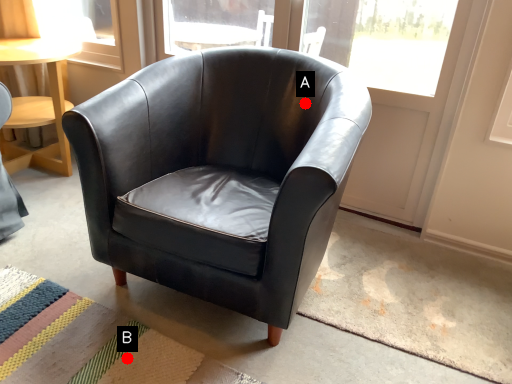
Question: Two points are circled on the image, labeled by A and B beside each circle. Which point appears closest to the camera in this image?

Choices:
 (A) A is closer
 (B) B is closer

Answer: (B)